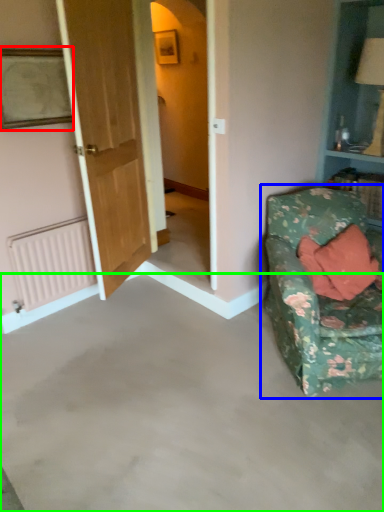
Question: Which object is the closest to the picture frame (highlighted by a red box)? Choose among these: studio couch (highlighted by a blue box) or concrete (highlighted by a green box).

Choices:
 (A) studio couch
 (B) concrete

Answer: (B)